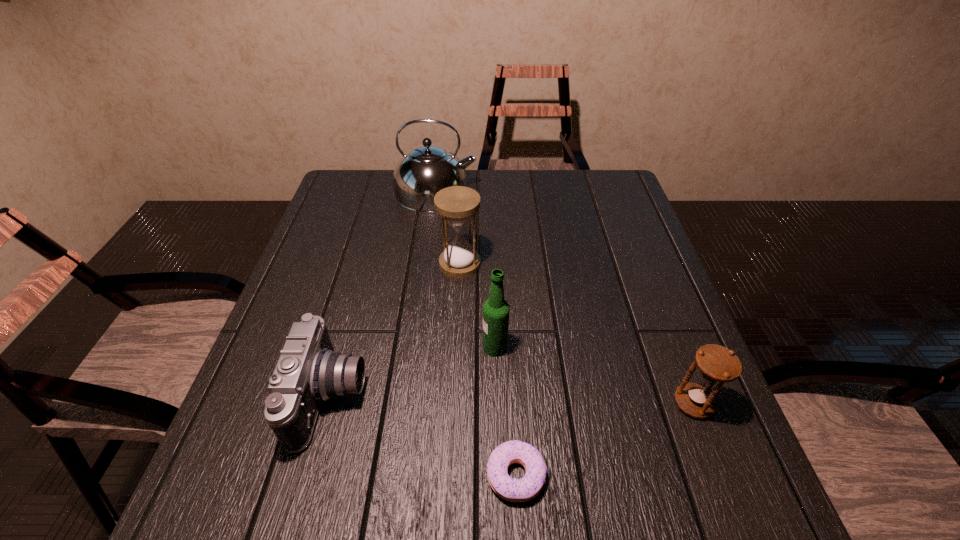
Where is `free space located on the label of the beer bottle`? This screenshot has width=960, height=540. free space located on the label of the beer bottle is located at coordinates (372, 347).

Where is `free space located on the label of the beer bottle`? The height and width of the screenshot is (540, 960). free space located on the label of the beer bottle is located at coordinates (432, 347).

The height and width of the screenshot is (540, 960). I want to click on vacant region located 0.270m on the back of the fifth nearest object, so click(x=464, y=194).

Where is `vacant space situated on the front-facing side of the camera`? The height and width of the screenshot is (540, 960). vacant space situated on the front-facing side of the camera is located at coordinates click(471, 396).

In order to click on vacant point located 0.070m on the back of the right hourglass in this screenshot , I will do `click(676, 358)`.

Locate an element on the screen. This screenshot has height=540, width=960. free space located 0.250m on the left of the shortest object is located at coordinates (342, 475).

The width and height of the screenshot is (960, 540). What are the coordinates of `object present at the far edge` in the screenshot? It's located at (426, 169).

Identify the location of object that is at the near edge. (528, 487).

Where is `object that is at the left edge`? object that is at the left edge is located at coordinates (308, 372).

Find the location of a particular element. This screenshot has width=960, height=540. object located in the right edge section of the desktop is located at coordinates (716, 363).